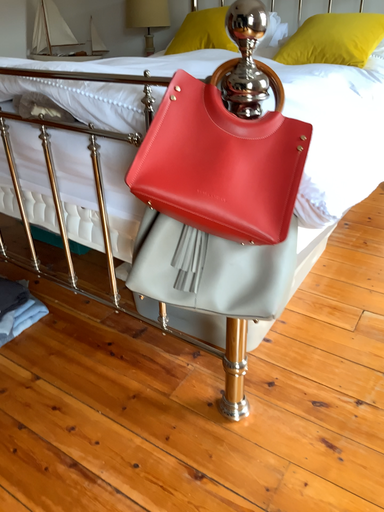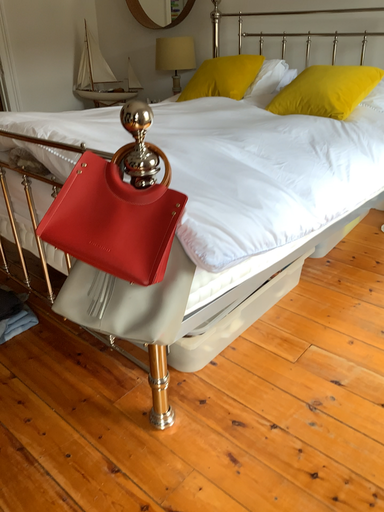
Question: Which way did the camera rotate in the video?

Choices:
 (A) rotated left
 (B) rotated right

Answer: (A)